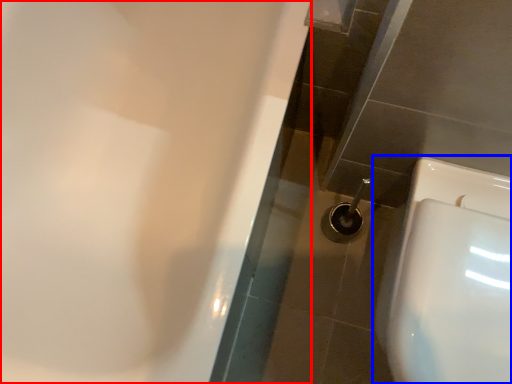
Question: Which point is further to the camera, bath (highlighted by a red box) or toilet (highlighted by a blue box)?

Choices:
 (A) bath
 (B) toilet

Answer: (B)